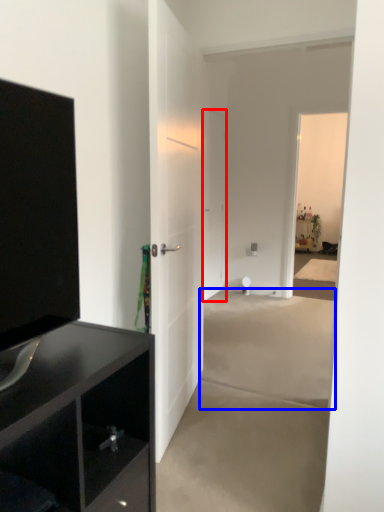
Question: Among these objects, which one is farthest to the camera, door (highlighted by a red box) or concrete (highlighted by a blue box)?

Choices:
 (A) door
 (B) concrete

Answer: (A)